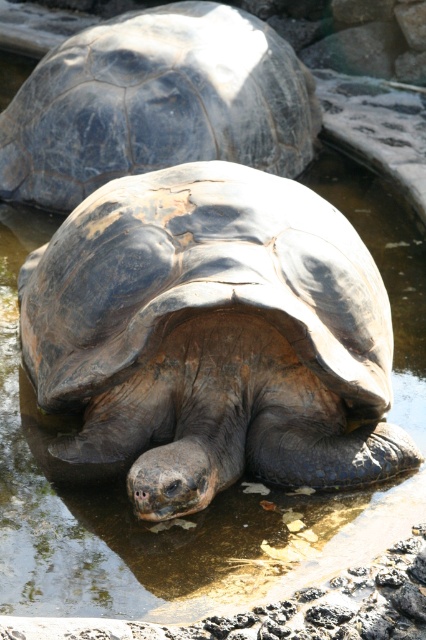
Who is more distant from viewer, (170, 253) or (210, 10)?

Positioned behind is point (210, 10).

Does leathery brown tortoise at center appear over dark gray textured shell at center?

Incorrect, leathery brown tortoise at center is not positioned above dark gray textured shell at center.

Locate an element on the screen. leathery brown tortoise at center is located at coordinates (213, 337).